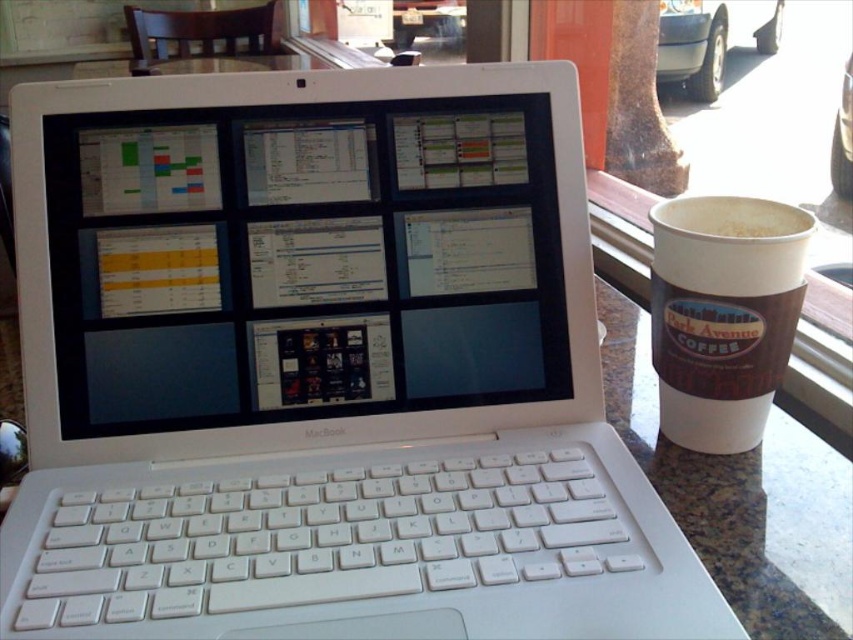
You are a remote worker who just arrived at the coffee shop and need to set up your workspace. You have a white plastic keyboard at center and a white paper cup at upper right. Which object is closer to you as you sit at the table?

The white plastic keyboard at center is closer to the viewer than the white paper cup at upper right, so the keyboard is closer to you as you sit at the table.

You are working on a laptop and need to reach for your keyboard without moving your arms too much. Based on the scene, where is the white plastic keyboard at center located relative to the white glossy laptop at center?

The white plastic keyboard at center is to the right of the white glossy laptop at center, so you can reach it by extending your arms slightly to the right.

You are standing in a cafe and want to place a small notebook on the table so that it is directly to the right of the white glossy laptop at center. Given that the table is rectangular and the laptop is at point (299, 248), where should you place the notebook?

To place the notebook directly to the right of the white glossy laptop at center located at point (299, 248), you should position it at a coordinate slightly higher on the x axis, such as 0.45, 0.351. This ensures the notebook is directly to the right while maintaining the same y coordinate.